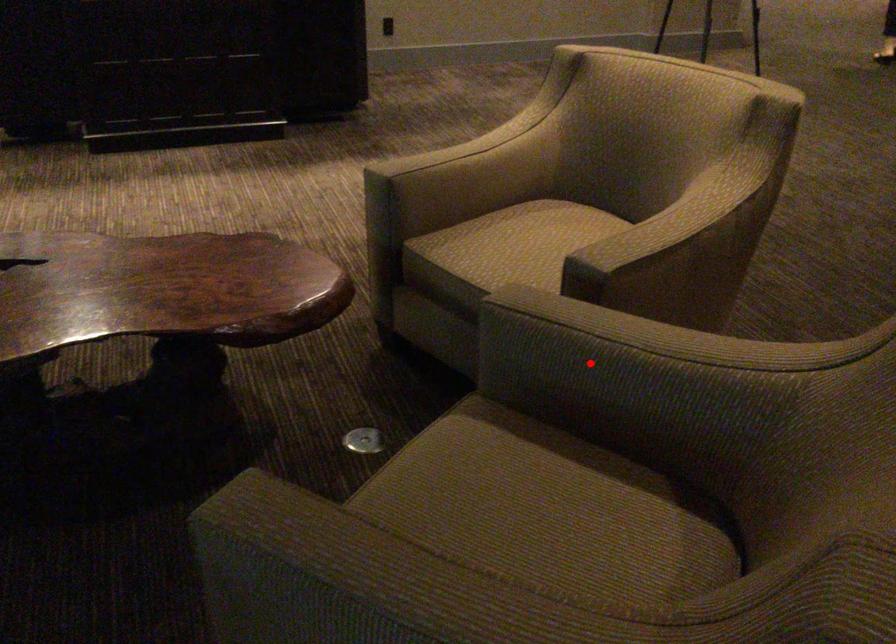
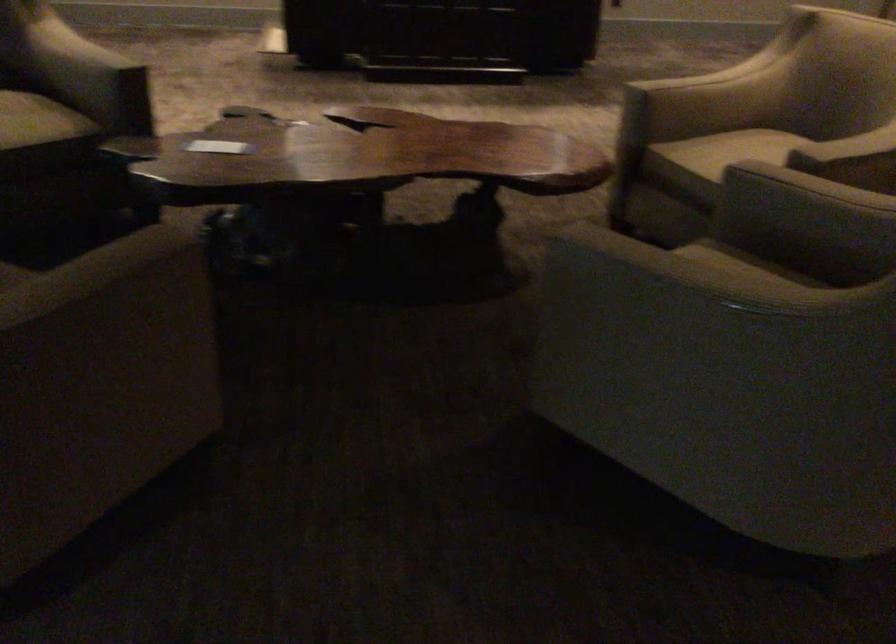
The point at the highlighted location is marked in the first image. Where is the corresponding point in the second image?

(806, 207)